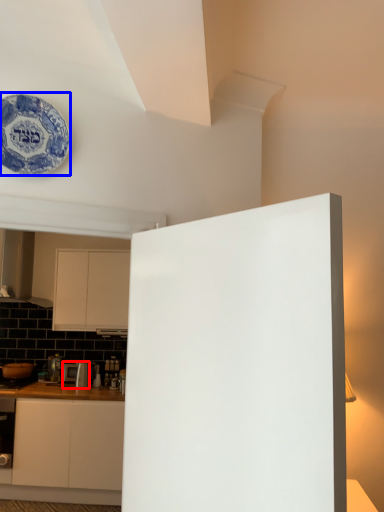
Question: Which point is further to the camera, appliance (highlighted by a red box) or plate (highlighted by a blue box)?

Choices:
 (A) appliance
 (B) plate

Answer: (A)